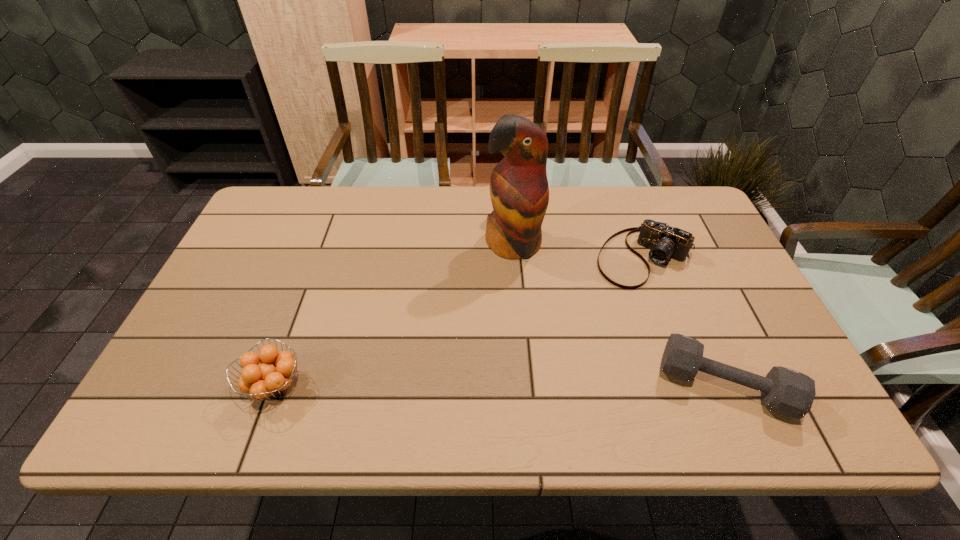
Image resolution: width=960 pixels, height=540 pixels. What are the coordinates of `object that is at the near right corner` in the screenshot? It's located at (784, 391).

The width and height of the screenshot is (960, 540). In the image, there is a desktop. Find the location of `vacant space at the far edge`. vacant space at the far edge is located at coordinates (434, 214).

The width and height of the screenshot is (960, 540). In the image, there is a desktop. Identify the location of vacant space at the near edge. (624, 366).

The height and width of the screenshot is (540, 960). In the image, there is a desktop. What are the coordinates of `free region at the left edge` in the screenshot? It's located at (274, 251).

The width and height of the screenshot is (960, 540). In the image, there is a desktop. Find the location of `vacant space at the right edge`. vacant space at the right edge is located at coordinates (718, 322).

Find the location of a particular element. The width and height of the screenshot is (960, 540). vacant space at the far left corner of the desktop is located at coordinates (296, 207).

Locate an element on the screen. free space at the far right corner is located at coordinates (656, 212).

You are a GUI agent. You are given a task and a screenshot of the screen. Output one action in this format:
    pyautogui.click(x=<x>, y=<y>)
    Task: Click on the vacant point located between the orange fruit and the camera
    The height and width of the screenshot is (540, 960).
    Given the screenshot: What is the action you would take?
    pyautogui.click(x=459, y=321)

Identify the location of free space between the leftmost object and the dumbbell. (499, 385).

What are the coordinates of `vacant area that lies between the tallest object and the dumbbell` in the screenshot? It's located at (619, 315).